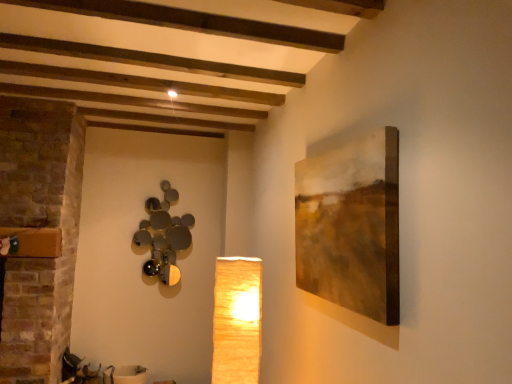
Question: Considering the relative sizes of matte yellow paper lampshade at center, the second lamp viewed from the left, and matte brown canvas at right in the image provided, is matte yellow paper lampshade at center, the second lamp viewed from the left, taller than matte brown canvas at right?

Choices:
 (A) yes
 (B) no

Answer: (B)

Question: From a real-world perspective, is matte yellow paper lampshade at center, the second lamp viewed from the left, positioned over matte brown canvas at right based on gravity?

Choices:
 (A) no
 (B) yes

Answer: (A)

Question: Is matte yellow paper lampshade at center, the 1th lamp viewed from the right, surrounding matte brown canvas at right?

Choices:
 (A) no
 (B) yes

Answer: (A)

Question: Is matte yellow paper lampshade at center, marked as the 2th lamp in a back-to-front arrangement, turned away from matte brown canvas at right?

Choices:
 (A) no
 (B) yes

Answer: (A)

Question: Are matte yellow paper lampshade at center, marked as the 2th lamp in a back-to-front arrangement, and matte brown canvas at right located far from each other?

Choices:
 (A) no
 (B) yes

Answer: (A)

Question: From the image's perspective, is matte yellow paper lampshade at center, positioned as the 1th lamp in front-to-back order, located beneath matte brown canvas at right?

Choices:
 (A) no
 (B) yes

Answer: (B)

Question: Is metallic reflective spheres at upper left, which is counted as the second lamp, starting from the front, smaller than matte yellow paper lampshade at center, the 1th lamp viewed from the right?

Choices:
 (A) yes
 (B) no

Answer: (A)

Question: Considering the relative sizes of metallic reflective spheres at upper left, which ranks as the 1th lamp in back-to-front order, and matte yellow paper lampshade at center, positioned as the 1th lamp in front-to-back order, in the image provided, is metallic reflective spheres at upper left, which ranks as the 1th lamp in back-to-front order, shorter than matte yellow paper lampshade at center, positioned as the 1th lamp in front-to-back order,?

Choices:
 (A) yes
 (B) no

Answer: (B)

Question: Considering the relative positions of metallic reflective spheres at upper left, which ranks as the 1th lamp in back-to-front order, and matte yellow paper lampshade at center, positioned as the 1th lamp in front-to-back order, in the image provided, is metallic reflective spheres at upper left, which ranks as the 1th lamp in back-to-front order, to the right of matte yellow paper lampshade at center, positioned as the 1th lamp in front-to-back order, from the viewer's perspective?

Choices:
 (A) yes
 (B) no

Answer: (B)

Question: Does metallic reflective spheres at upper left, which is counted as the second lamp, starting from the front, have a greater width compared to matte yellow paper lampshade at center, the second lamp viewed from the left?

Choices:
 (A) no
 (B) yes

Answer: (A)

Question: Does metallic reflective spheres at upper left, which ranks as the 1th lamp in back-to-front order, lie behind matte yellow paper lampshade at center, positioned as the 1th lamp in front-to-back order?

Choices:
 (A) no
 (B) yes

Answer: (B)

Question: Is metallic reflective spheres at upper left, which ranks as the 1th lamp in back-to-front order, next to matte yellow paper lampshade at center, marked as the 2th lamp in a back-to-front arrangement?

Choices:
 (A) no
 (B) yes

Answer: (A)

Question: From the image's perspective, would you say matte yellow paper lampshade at center, positioned as the 1th lamp in front-to-back order, is shown under metallic reflective spheres at upper left, which is counted as the second lamp, starting from the front?

Choices:
 (A) yes
 (B) no

Answer: (A)